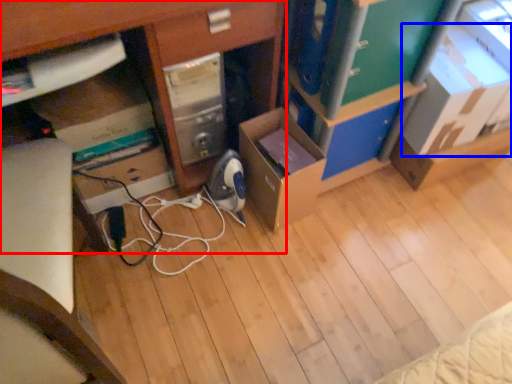
Question: Which of the following is the farthest to the observer, desk (highlighted by a red box) or cardboard box (highlighted by a blue box)?

Choices:
 (A) desk
 (B) cardboard box

Answer: (B)